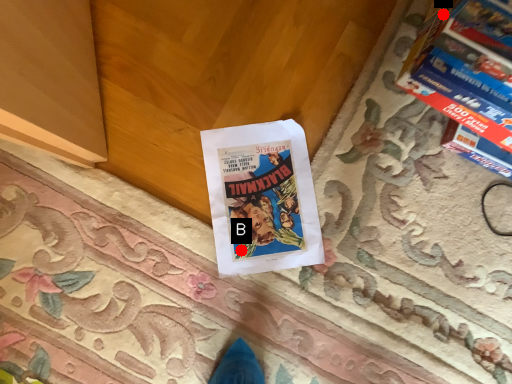
Question: Two points are circled on the image, labeled by A and B beside each circle. Which point is closer to the camera taking this photo?

Choices:
 (A) A is closer
 (B) B is closer

Answer: (A)